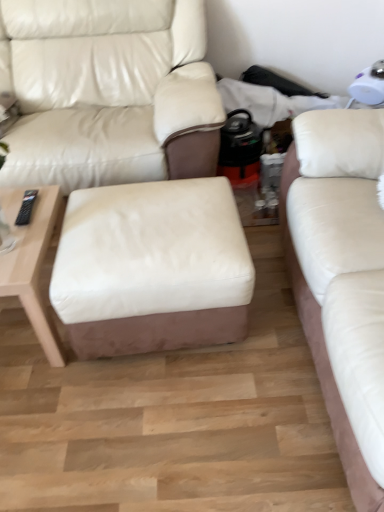
Find the location of a particular element. This screenshot has width=384, height=512. white leather ottoman at center is located at coordinates (152, 268).

The height and width of the screenshot is (512, 384). I want to click on white leather studio couch at center, arranged as the 1th studio couch when viewed from the left, so click(x=110, y=92).

Locate an element on the screen. The image size is (384, 512). light wood/woodentable at left is located at coordinates (31, 264).

From a real-world perspective, between white leather studio couch at center, acting as the second studio couch starting from the right, and white leather ottoman at center, who is vertically higher?

In real-world perspective, white leather studio couch at center, acting as the second studio couch starting from the right, is above.

Is white leather studio couch at center, arranged as the 1th studio couch when viewed from the left, thinner than white leather ottoman at center?

In fact, white leather studio couch at center, arranged as the 1th studio couch when viewed from the left, might be wider than white leather ottoman at center.

Between white leather studio couch at center, acting as the second studio couch starting from the right, and white leather ottoman at center, which one has less height?

With less height is white leather ottoman at center.

Considering the positions of objects white leather studio couch at right, arranged as the 2th studio couch when viewed from the left, and white leather ottoman at center in the image provided, who is more to the left, white leather studio couch at right, arranged as the 2th studio couch when viewed from the left, or white leather ottoman at center?

Positioned to the left is white leather ottoman at center.

From the image's perspective, which one is positioned lower, white leather studio couch at right, arranged as the 2th studio couch when viewed from the left, or white leather ottoman at center?

From the image's view, white leather ottoman at center is below.

Relative to white leather ottoman at center, is white leather studio couch at right, arranged as the 2th studio couch when viewed from the left, in front or behind?

white leather studio couch at right, arranged as the 2th studio couch when viewed from the left, is in front of white leather ottoman at center.

Based on the photo, is the surface of white leather ottoman at center in direct contact with white leather studio couch at center, arranged as the 1th studio couch when viewed from the left?

No, white leather ottoman at center is not next to white leather studio couch at center, arranged as the 1th studio couch when viewed from the left.

Does white leather ottoman at center have a lesser height compared to white leather studio couch at center, acting as the second studio couch starting from the right?

Yes, white leather ottoman at center is shorter than white leather studio couch at center, acting as the second studio couch starting from the right.

Looking at this image, which of these two, white leather ottoman at center or white leather studio couch at center, arranged as the 1th studio couch when viewed from the left, is thinner?

With smaller width is white leather ottoman at center.

Is white leather studio couch at center, acting as the second studio couch starting from the right, positioned before light wood/woodentable at left?

That is False.

Does white leather studio couch at center, acting as the second studio couch starting from the right, touch light wood/woodentable at left?

No, white leather studio couch at center, acting as the second studio couch starting from the right, is not with light wood/woodentable at left.

Is white leather studio couch at center, arranged as the 1th studio couch when viewed from the left, oriented towards light wood/woodentable at left?

Yes.

In the scene shown: Measure the distance between light wood/woodentable at left and white leather studio couch at center, acting as the second studio couch starting from the right.

They are 26.30 inches apart.

From a real-world perspective, is light wood/woodentable at left above or below white leather studio couch at center, arranged as the 1th studio couch when viewed from the left?

In terms of real-world spatial position, light wood/woodentable at left is below white leather studio couch at center, arranged as the 1th studio couch when viewed from the left.

Is light wood/woodentable at left spatially inside white leather studio couch at center, acting as the second studio couch starting from the right, or outside of it?

light wood/woodentable at left is not inside white leather studio couch at center, acting as the second studio couch starting from the right, it's outside.

From the image's perspective, which is above, light wood/woodentable at left or white leather studio couch at center, arranged as the 1th studio couch when viewed from the left?

white leather studio couch at center, arranged as the 1th studio couch when viewed from the left, from the image's perspective.

How many degrees apart are the facing directions of light wood/woodentable at left and white leather studio couch at right, arranged as the 2th studio couch when viewed from the left?

They differ by 91.7 degrees in their facing directions.

Visually, is light wood/woodentable at left positioned to the left or to the right of white leather studio couch at right, which is the first studio couch in right-to-left order?

From the image, it's evident that light wood/woodentable at left is to the left of white leather studio couch at right, which is the first studio couch in right-to-left order.

This screenshot has height=512, width=384. In order to click on studio couch that is the 1st one when counting upward from the light wood/woodentable at left (from the image's perspective) in this screenshot , I will do `click(341, 278)`.

In the image, there is a white leather ottoman at center. At what (x,y) coordinates should I click in order to perform the action: click on table below it (from a real-world perspective). Please return your answer as a coordinate pair (x, y). Looking at the image, I should click on (31, 264).

Does point (140, 231) appear closer or farther from the camera than point (9, 200)?

Point (140, 231) appears to be closer to the viewer than point (9, 200).

How different are the orientations of white leather ottoman at center and light wood/woodentable at left in degrees?

1.35 degrees.

Could you tell me if white leather ottoman at center is turned towards light wood/woodentable at left?

No, white leather ottoman at center is not aimed at light wood/woodentable at left.

The width and height of the screenshot is (384, 512). I want to click on studio couch that is the 1st object above the white leather ottoman at center (from a real-world perspective), so click(110, 92).

The width and height of the screenshot is (384, 512). Find the location of `stool below the white leather studio couch at right, arranged as the 2th studio couch when viewed from the left (from a real-world perspective)`. stool below the white leather studio couch at right, arranged as the 2th studio couch when viewed from the left (from a real-world perspective) is located at coordinates (152, 268).

Based on their spatial positions, is white leather ottoman at center or white leather studio couch at right, arranged as the 2th studio couch when viewed from the left, closer to white leather studio couch at center, acting as the second studio couch starting from the right?

The object closer to white leather studio couch at center, acting as the second studio couch starting from the right, is white leather ottoman at center.

When comparing their distances from white leather studio couch at center, acting as the second studio couch starting from the right, does white leather studio couch at right, arranged as the 2th studio couch when viewed from the left, or white leather ottoman at center seem further?

white leather studio couch at right, arranged as the 2th studio couch when viewed from the left.

Which object lies further to the anchor point white leather ottoman at center, white leather studio couch at center, acting as the second studio couch starting from the right, or white leather studio couch at right, arranged as the 2th studio couch when viewed from the left?

The object further to white leather ottoman at center is white leather studio couch at center, acting as the second studio couch starting from the right.

Which object lies nearer to the anchor point white leather ottoman at center, white leather studio couch at right, arranged as the 2th studio couch when viewed from the left, or white leather studio couch at center, acting as the second studio couch starting from the right?

white leather studio couch at right, arranged as the 2th studio couch when viewed from the left, is closer to white leather ottoman at center.

Estimate the real-world distances between objects in this image. Which object is closer to white leather studio couch at right, which is the first studio couch in right-to-left order, light wood/woodentable at left or white leather ottoman at center?

white leather ottoman at center is positioned closer to the anchor white leather studio couch at right, which is the first studio couch in right-to-left order.

From the image, which object appears to be farther from white leather studio couch at center, arranged as the 1th studio couch when viewed from the left, white leather ottoman at center or light wood/woodentable at left?

light wood/woodentable at left.

From the image, which object appears to be nearer to white leather ottoman at center, light wood/woodentable at left or white leather studio couch at right, which is the first studio couch in right-to-left order?

light wood/woodentable at left is closer to white leather ottoman at center.

Looking at the image, which one is located further to light wood/woodentable at left, white leather ottoman at center or white leather studio couch at right, arranged as the 2th studio couch when viewed from the left?

white leather studio couch at right, arranged as the 2th studio couch when viewed from the left.

You are a GUI agent. You are given a task and a screenshot of the screen. Output one action in this format:
    pyautogui.click(x=<x>, y=<y>)
    Task: Click on the stool between light wood/woodentable at left and white leather studio couch at right, arranged as the 2th studio couch when viewed from the left, in the horizontal direction
    
    Given the screenshot: What is the action you would take?
    pyautogui.click(x=152, y=268)

This screenshot has height=512, width=384. Identify the location of studio couch between light wood/woodentable at left and white leather studio couch at right, arranged as the 2th studio couch when viewed from the left. (110, 92).

Where is `stool located between white leather studio couch at center, arranged as the 1th studio couch when viewed from the left, and white leather studio couch at right, which is the first studio couch in right-to-left order, in the left-right direction`? stool located between white leather studio couch at center, arranged as the 1th studio couch when viewed from the left, and white leather studio couch at right, which is the first studio couch in right-to-left order, in the left-right direction is located at coordinates pyautogui.click(x=152, y=268).

Identify the location of stool between white leather studio couch at center, arranged as the 1th studio couch when viewed from the left, and light wood/woodentable at left from top to bottom. The image size is (384, 512). (152, 268).